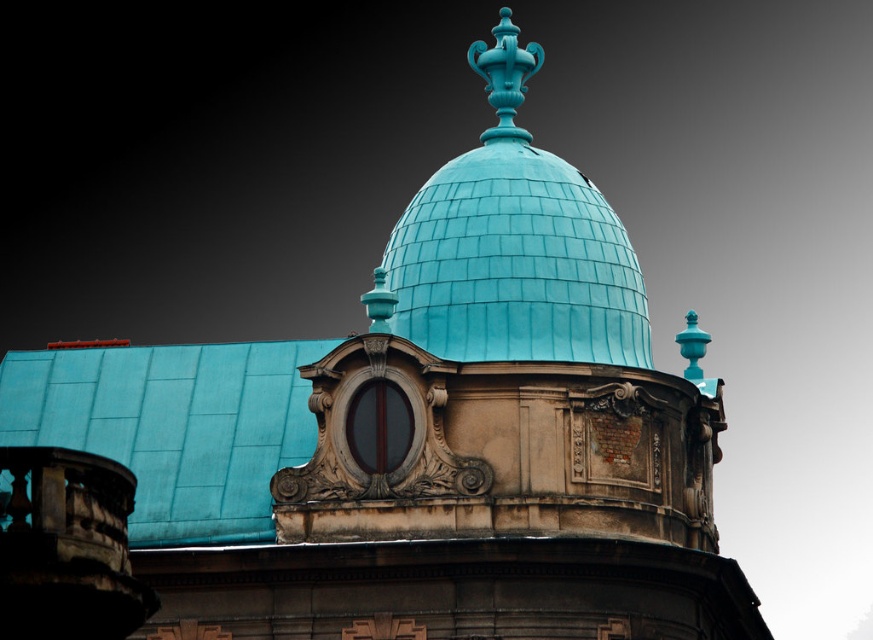
Question: Considering the relative positions of teal shingled dome at center and matte turquoise vase at center in the image provided, where is teal shingled dome at center located with respect to matte turquoise vase at center?

Choices:
 (A) left
 (B) right

Answer: (A)

Question: Where is teal shingled dome at center located in relation to matte turquoise vase at center in the image?

Choices:
 (A) right
 (B) left

Answer: (B)

Question: Can you confirm if teal shingled dome at center is smaller than matte turquoise vase at center?

Choices:
 (A) yes
 (B) no

Answer: (B)

Question: Which point is farther to the camera?

Choices:
 (A) matte turquoise vase at center
 (B) teal shingled dome at center

Answer: (A)